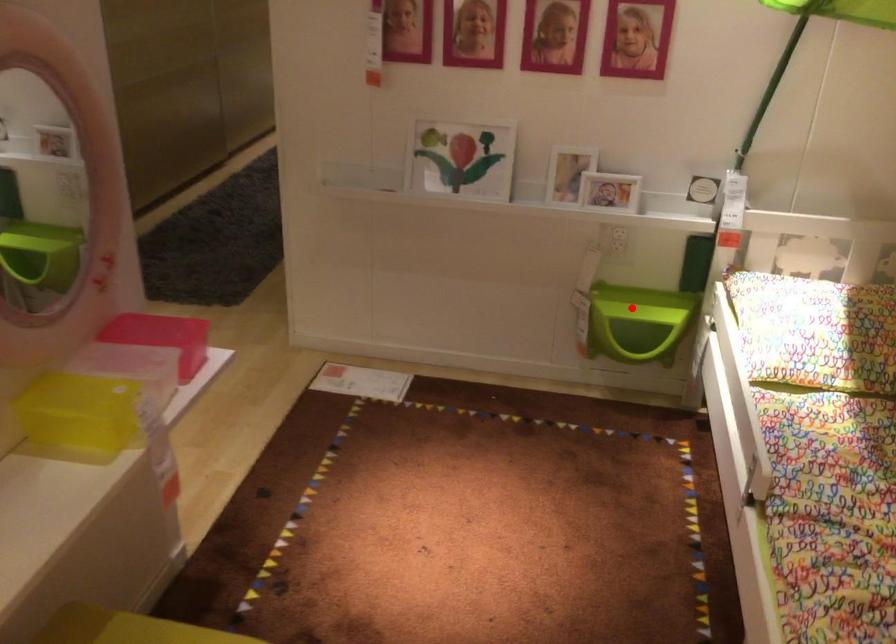
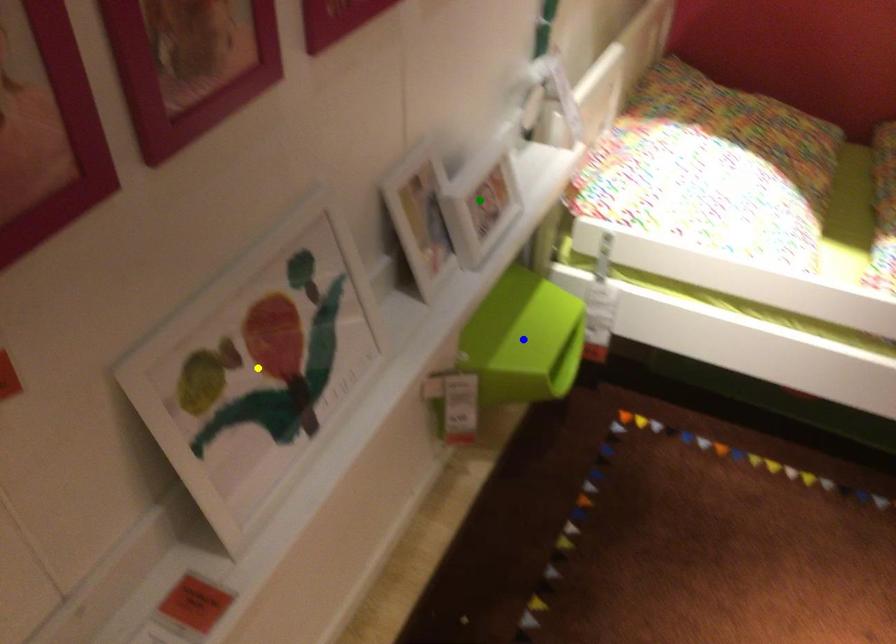
Question: I am providing you with two images of the same scene from different viewpoints. A red point is marked on the first image. You are given multiple points on the second image. Which spot in image 2 lines up with the point in image 1?

Choices:
 (A) green point
 (B) yellow point
 (C) blue point

Answer: (C)